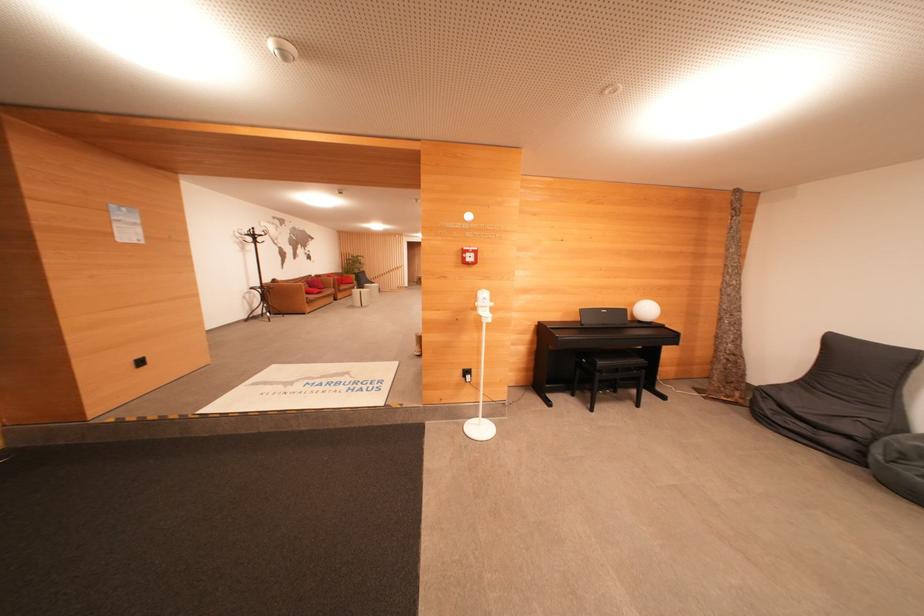
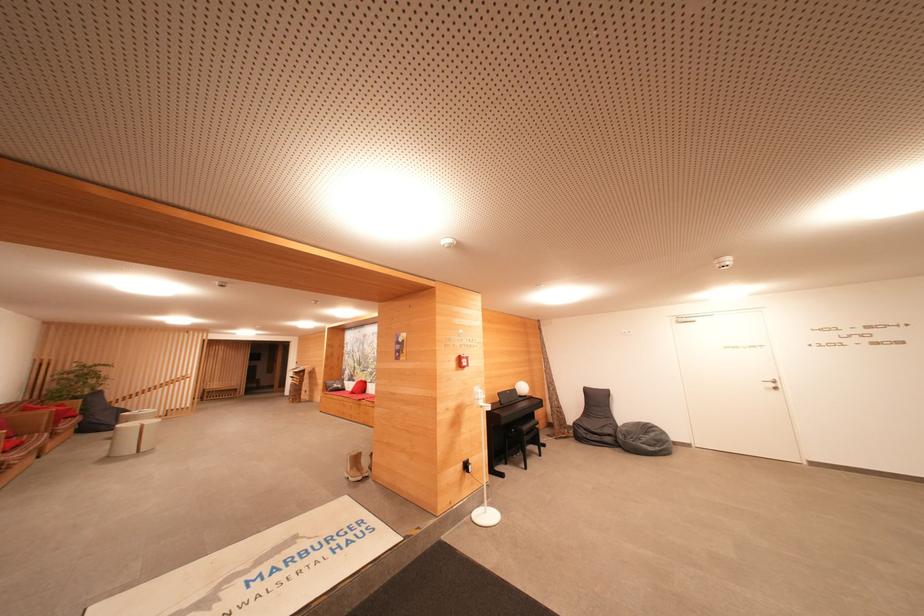
The point at (471, 254) is marked in the first image. Where is the corresponding point in the second image?

(468, 361)